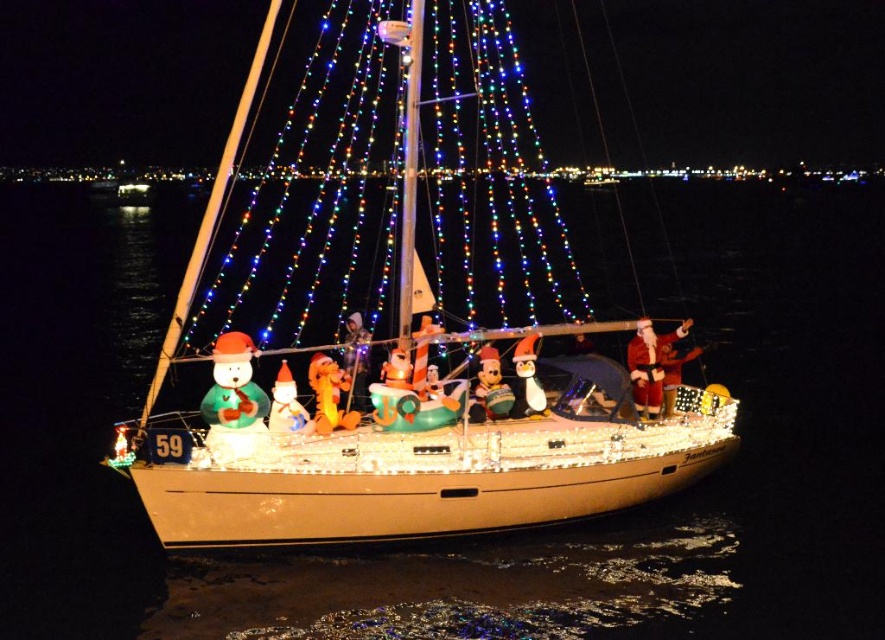
Is illuminated string lights at center below green matte snowman at center?

Actually, illuminated string lights at center is above green matte snowman at center.

Between illuminated string lights at center and green matte snowman at center, which one has more height?

With more height is illuminated string lights at center.

This screenshot has width=885, height=640. What do you see at coordinates (320, 193) in the screenshot?
I see `illuminated string lights at center` at bounding box center [320, 193].

Identify the location of illuminated string lights at center. (320, 193).

Is glossy plastic reindeer at center behind matte plastic snowman at center?

Yes, glossy plastic reindeer at center is behind matte plastic snowman at center.

Is glossy plastic reindeer at center positioned before matte plastic snowman at center?

No.

Is point (342, 417) farther from viewer compared to point (305, 424)?

Yes, point (342, 417) is behind point (305, 424).

The width and height of the screenshot is (885, 640). Find the location of `glossy plastic reindeer at center`. glossy plastic reindeer at center is located at coordinates (329, 394).

Does illuminated string lights at center appear on the right side of white glossy sailboat at center?

In fact, illuminated string lights at center is to the left of white glossy sailboat at center.

Based on the photo, is illuminated string lights at center behind white glossy sailboat at center?

Yes, illuminated string lights at center is further from the viewer.

The width and height of the screenshot is (885, 640). I want to click on illuminated string lights at center, so click(x=320, y=193).

Locate an element on the screen. This screenshot has width=885, height=640. illuminated string lights at center is located at coordinates (320, 193).